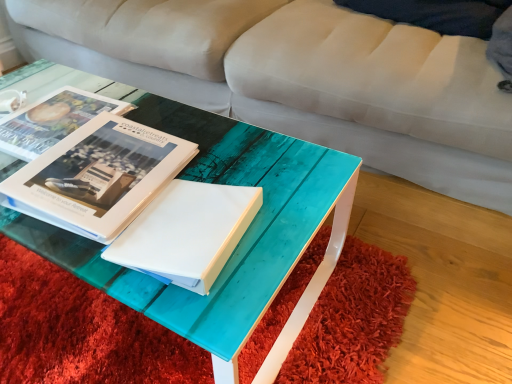
Question: Is matte white book at center, which appears as the 2th book when viewed from the front, wider or thinner than white matte paper at center?

Choices:
 (A) wide
 (B) thin

Answer: (A)

Question: Does point (36, 147) appear closer or farther from the camera than point (201, 264)?

Choices:
 (A) closer
 (B) farther

Answer: (B)

Question: Based on their relative distances, which object is farther from the white matte paper at center?

Choices:
 (A) matte white book at center, which appears as the 2th book when viewed from the front
 (B) translucent teal table at center
 (C) matte white book at center, marked as the first book in a front-to-back arrangement
 (D) teal glossy wood coffee table at center

Answer: (A)

Question: Estimate the real-world distances between objects in this image. Which object is closer to the translucent teal table at center?

Choices:
 (A) matte white book at center, the first book positioned from the back
 (B) white matte paper at center
 (C) matte white book at center, which appears as the second book when viewed from the back
 (D) teal glossy wood coffee table at center

Answer: (D)